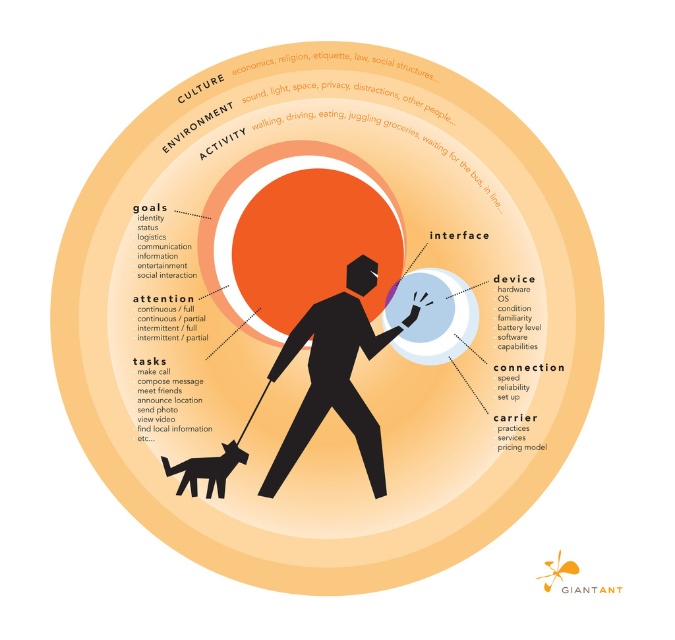
You are an architect designing a new public space and want to incorporate elements from the diagram. You have both the transparent glass sphere at center and the transparent plastic bubble at center available. Which object should be placed to the right of the other to align with the spatial arrangement shown in the diagram?

The transparent glass sphere at center should be placed to the left of the transparent plastic bubble at center, so the transparent plastic bubble at center should be to the right of the transparent glass sphere at center.

You are analyzing the circular diagram and notice two points labeled as point (236, 58) and point (450, 304). From your perspective, which point appears closer to you?

Point (236, 58) is closer to the camera than point (450, 304).

Based on the circular diagram describing human interaction with technology, which includes a central figure of a person walking a dog and concentric rings representing different aspects, where is the point located at coordinates (296, 232) in relation to the orange matte circle at center?

The point at coordinates (296, 232) is on the orange matte circle at center.